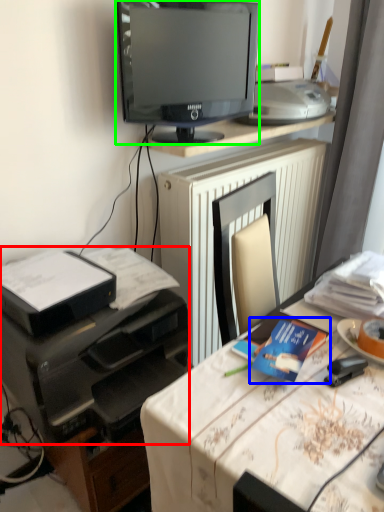
Question: Estimate the real-world distances between objects in this image. Which object is farther from printer (highlighted by a red box), paperback book (highlighted by a blue box) or television (highlighted by a green box)?

Choices:
 (A) paperback book
 (B) television

Answer: (B)